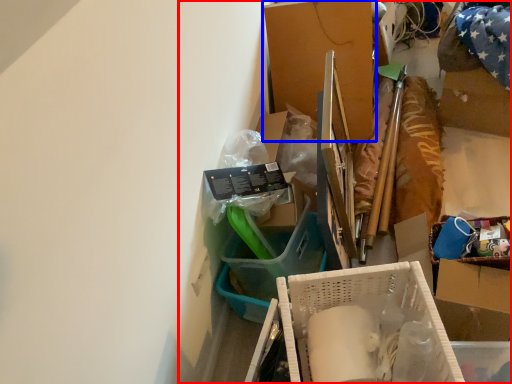
Question: Which object appears farthest to the camera in this image, collection (highlighted by a red box) or box (highlighted by a blue box)?

Choices:
 (A) collection
 (B) box

Answer: (B)